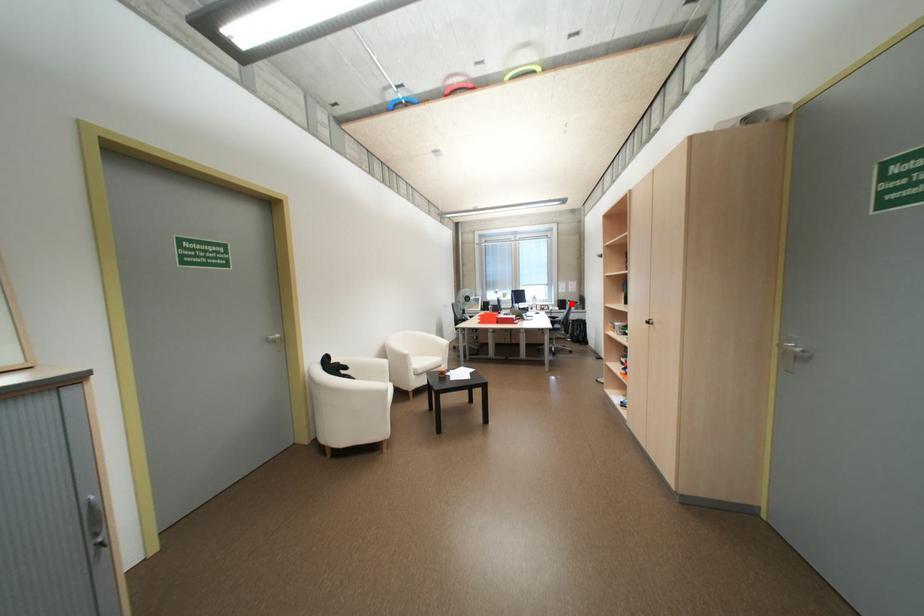
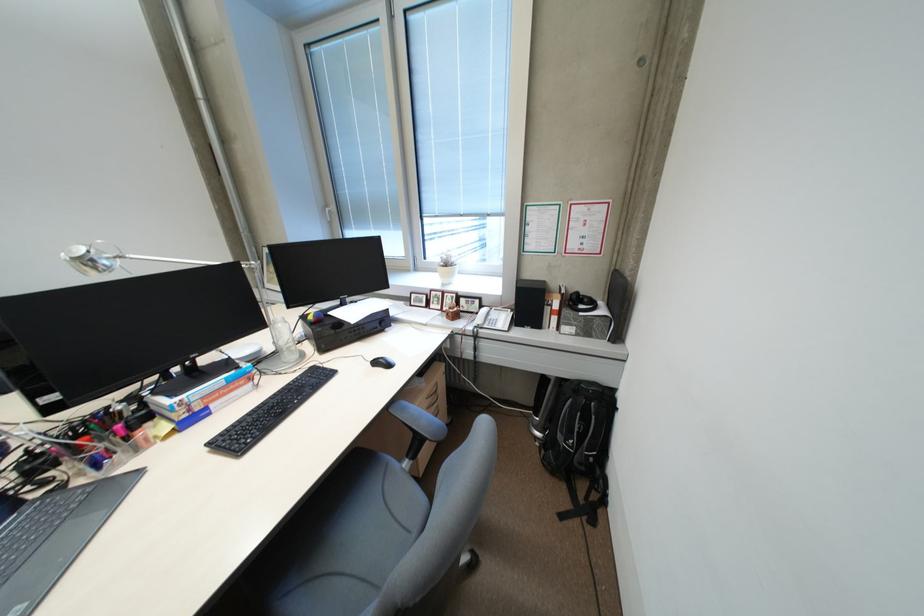
Where in the second image is the point corresponding to the highlighted location from the first image?

(538, 302)